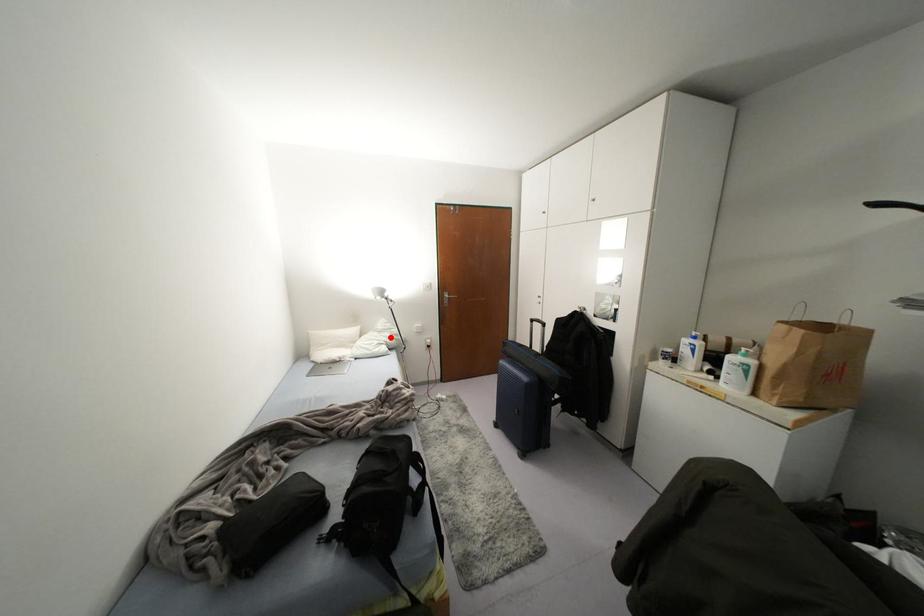
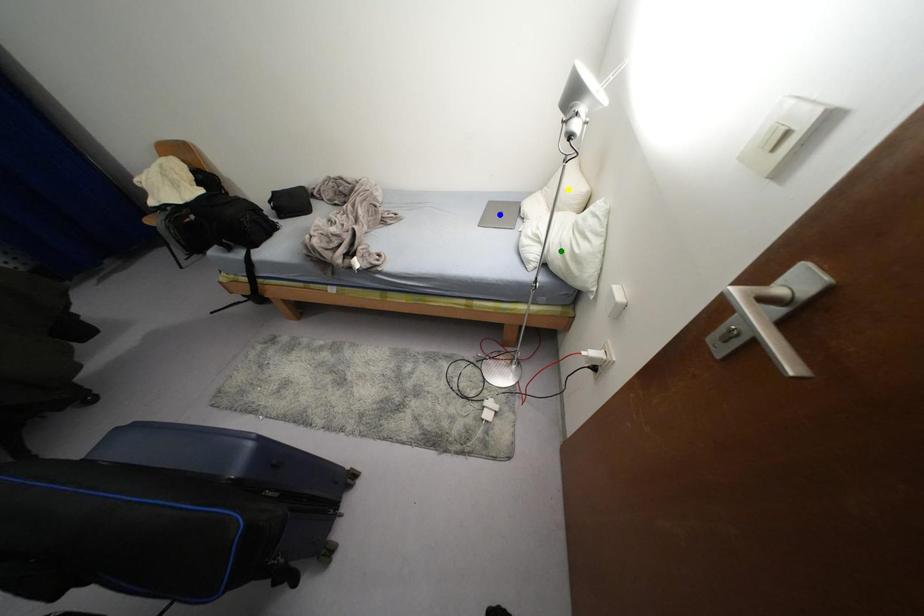
Question: I am providing you with two images of the same scene from different viewpoints. A red point is marked on the first image. You are given multiple points on the second image. In image 2, which mark is for the same physical point as the one in image 1?

Choices:
 (A) yellow point
 (B) blue point
 (C) green point

Answer: (C)